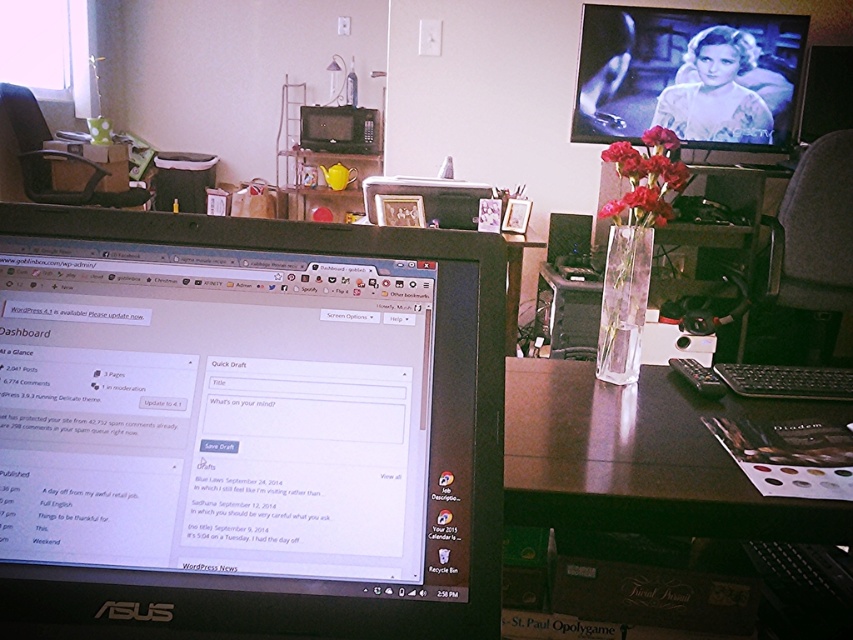
Question: Which point is closer to the camera?

Choices:
 (A) (625, 200)
 (B) (718, 74)

Answer: (A)

Question: Considering the real-world distances, which object is closest to the black glossy monitor at center?

Choices:
 (A) black glossy table at center
 (B) matte glass vase at center

Answer: (A)

Question: From the image, what is the correct spatial relationship of black glossy monitor at center in relation to matte glass vase at center?

Choices:
 (A) above
 (B) below

Answer: (B)

Question: Can you confirm if black glossy monitor at center is wider than matte black monitor at upper right?

Choices:
 (A) yes
 (B) no

Answer: (B)

Question: Which object is closer to the camera taking this photo?

Choices:
 (A) matte glass vase at center
 (B) black glossy monitor at center
 (C) black glossy table at center
 (D) matte black monitor at upper right

Answer: (B)

Question: In this image, where is black glossy table at center located relative to matte glass vase at center?

Choices:
 (A) below
 (B) above

Answer: (A)